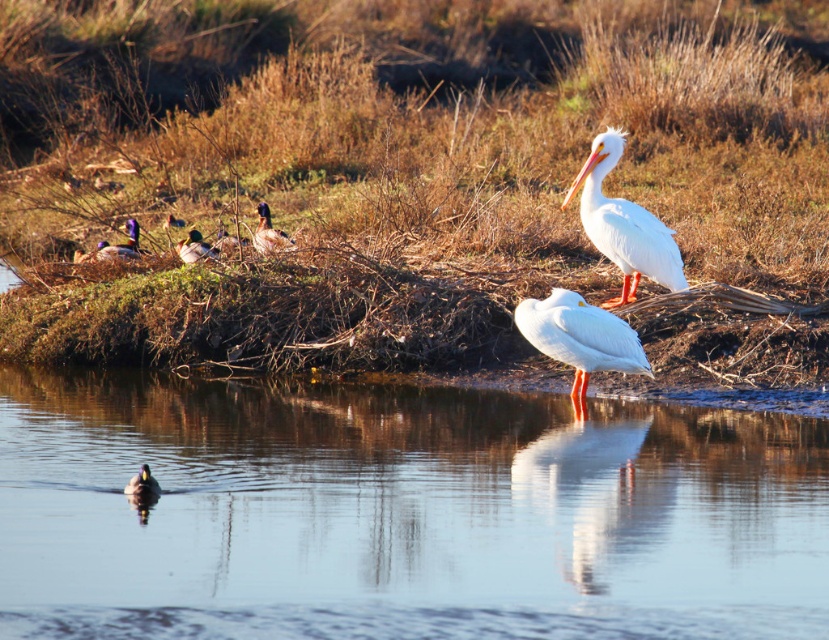
Is white smooth pelican at center closer to the viewer compared to brown speckled duck at upper left?

Yes.

At what (x,y) coordinates should I click in order to perform the action: click on white smooth pelican at center. Please return your answer as a coordinate pair (x, y). Looking at the image, I should click on (580, 339).

Locate an element on the screen. white smooth pelican at center is located at coordinates (580, 339).

Does white smooth pelican at upper right appear on the right side of white smooth pelican at center?

Yes, white smooth pelican at upper right is to the right of white smooth pelican at center.

Is point (679, 276) more distant than point (599, 355)?

Yes, it is behind point (599, 355).

Is point (633, 288) more distant than point (597, 316)?

Yes, point (633, 288) is behind point (597, 316).

Locate an element on the screen. white smooth pelican at upper right is located at coordinates (623, 225).

Is point (553, 330) behind point (119, 244)?

No.

The image size is (829, 640). What are the coordinates of `white smooth pelican at center` in the screenshot? It's located at (580, 339).